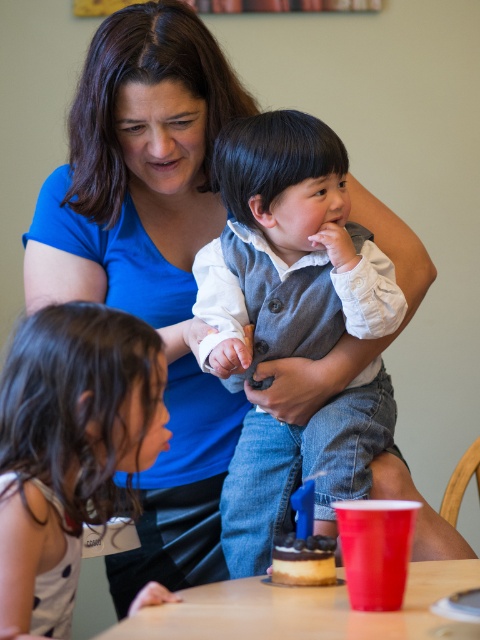
Looking at this image, is white dotted dress at lower left bigger than wooden table at lower center?

Yes.

Between point (39, 376) and point (227, 595), which one is positioned in front?

Point (227, 595) is in front.

You are a GUI agent. You are given a task and a screenshot of the screen. Output one action in this format:
    pyautogui.click(x=<x>, y=<y>)
    Task: Click on the white dotted dress at lower left
    
    Given the screenshot: What is the action you would take?
    pyautogui.click(x=71, y=436)

Is point (340, 449) positioned before point (6, 588)?

No, (340, 449) is further to viewer.

Looking at this image, does matte gray vest at center appear over white dotted dress at lower left?

Correct, matte gray vest at center is located above white dotted dress at lower left.

Identify the location of matte gray vest at center. The width and height of the screenshot is (480, 640). (288, 248).

What do you see at coordinates (288, 248) in the screenshot?
I see `matte gray vest at center` at bounding box center [288, 248].

This screenshot has width=480, height=640. Find the location of `matte gray vest at center`. matte gray vest at center is located at coordinates (288, 248).